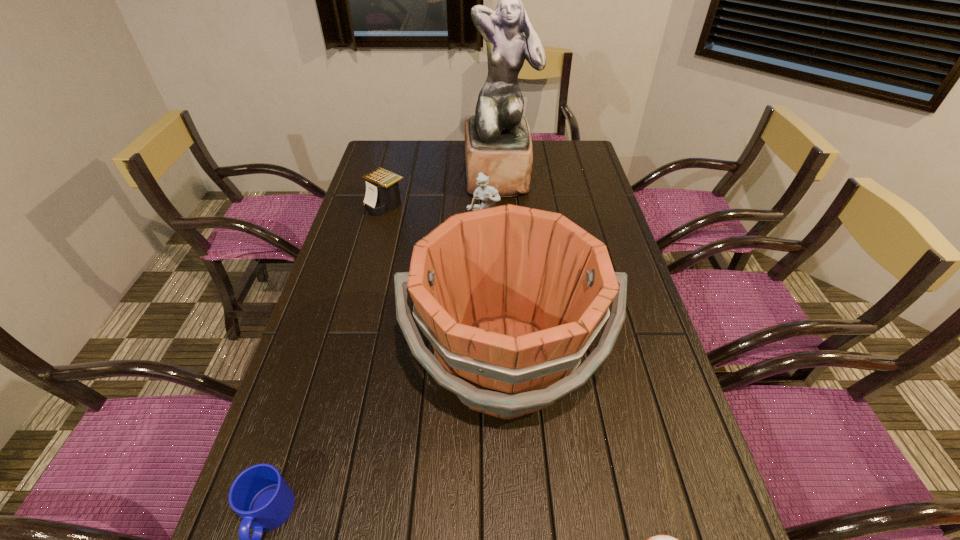
At what (x,y) coordinates should I click in order to perform the action: click on object that is at the far edge. Please return your answer as a coordinate pair (x, y). The width and height of the screenshot is (960, 540). Looking at the image, I should click on (498, 143).

Find the location of a particular element. Image resolution: width=960 pixels, height=540 pixels. object located in the left edge section of the desktop is located at coordinates (382, 195).

Image resolution: width=960 pixels, height=540 pixels. Identify the location of object located at the right edge. (510, 297).

In the image, there is a desktop. Where is `blank space at the far edge`? blank space at the far edge is located at coordinates (538, 157).

At what (x,y) coordinates should I click in order to perform the action: click on vacant region at the left edge. Please return your answer as a coordinate pair (x, y). Looking at the image, I should click on (348, 289).

Where is `free space at the right edge of the desktop`? The width and height of the screenshot is (960, 540). free space at the right edge of the desktop is located at coordinates (619, 455).

Find the location of a particular element. free space at the far left corner is located at coordinates (388, 143).

Where is `vacant space at the far right corner of the desktop`? The image size is (960, 540). vacant space at the far right corner of the desktop is located at coordinates (575, 168).

You are a GUI agent. You are given a task and a screenshot of the screen. Output one action in this format:
    pyautogui.click(x=<x>, y=<y>)
    Task: Click on the free space between the tallest object and the fourth tallest object
    This screenshot has width=960, height=540.
    Given the screenshot: What is the action you would take?
    pyautogui.click(x=443, y=191)

I want to click on empty space between the figurine and the calculator, so click(435, 226).